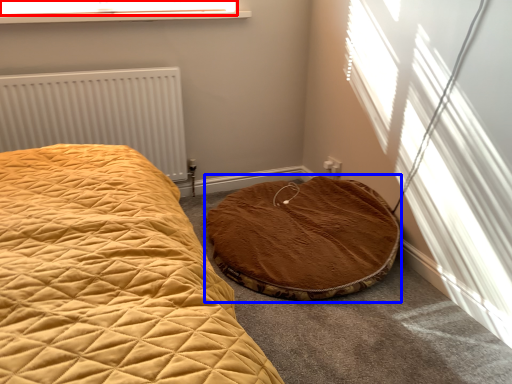
Question: Which object is closer to the camera taking this photo, window screen (highlighted by a red box) or cat bed (highlighted by a blue box)?

Choices:
 (A) window screen
 (B) cat bed

Answer: (B)